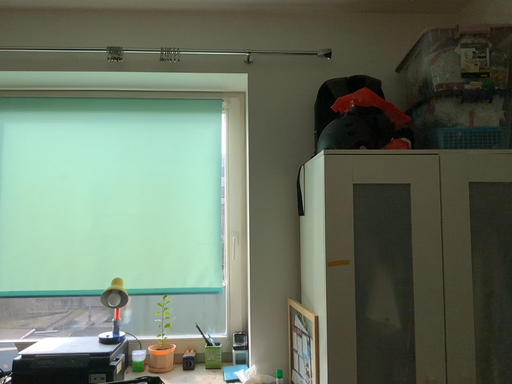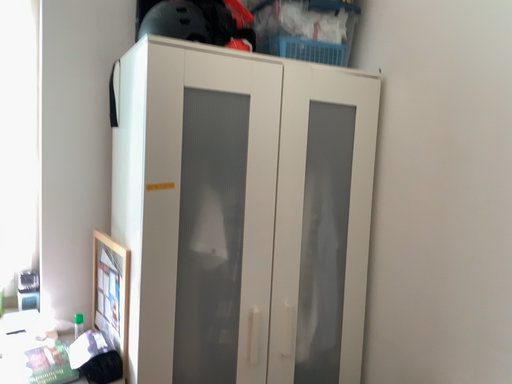
Question: Which way did the camera rotate in the video?

Choices:
 (A) rotated downward
 (B) rotated upward

Answer: (A)